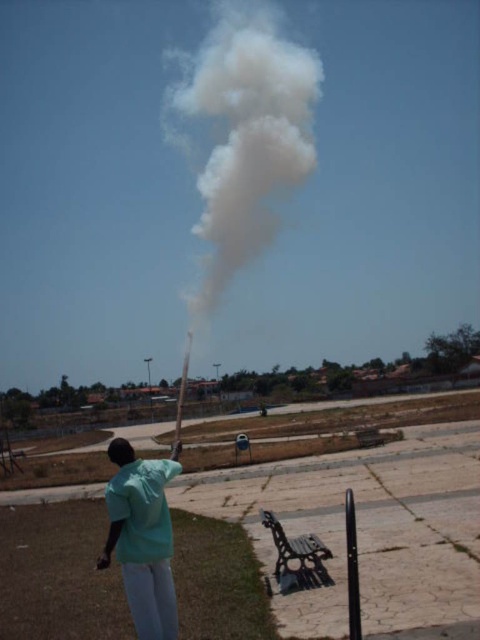
You are a photographer standing in the park and see the white fluffy smoke at center and the green fabric shirt at center. Which object is closer to you?

The white fluffy smoke at center is closer to you than the green fabric shirt at center because it is further to the viewer.

You are standing at the point with coordinates (x=245, y=136) in the scene. What object is located exactly at that point?

The white fluffy smoke at center is located exactly at point (x=245, y=136).

You are a photographer trying to capture the white fluffy smoke at center and the green fabric shirt at center in a single shot. Based on their sizes in the scene, which one will appear larger in the photo?

The white fluffy smoke at center is much taller than the green fabric shirt at center, so it will appear larger in the photo.